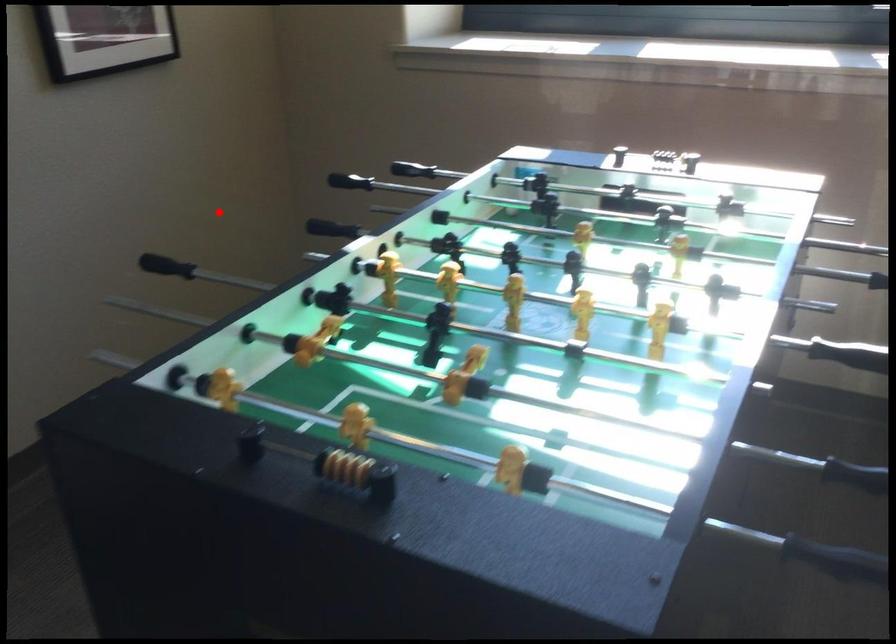
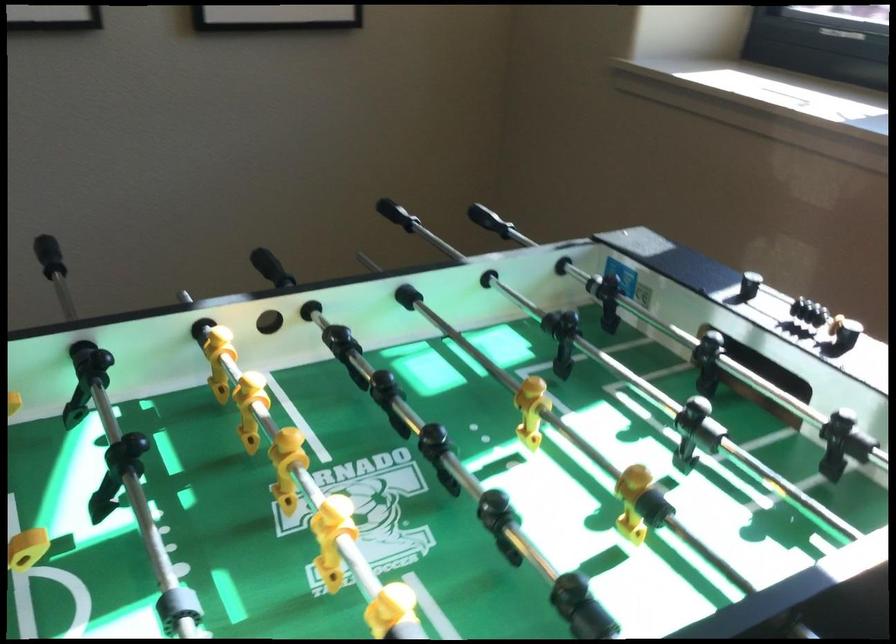
Locate, in the second image, the point that corresponds to the highlighted location in the first image.

(397, 214)